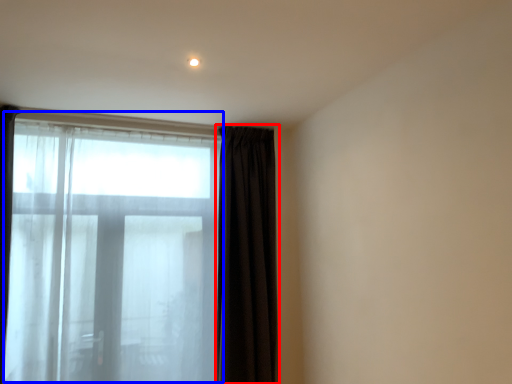
Question: Among these objects, which one is farthest to the camera, curtain (highlighted by a red box) or bay window (highlighted by a blue box)?

Choices:
 (A) curtain
 (B) bay window

Answer: (A)